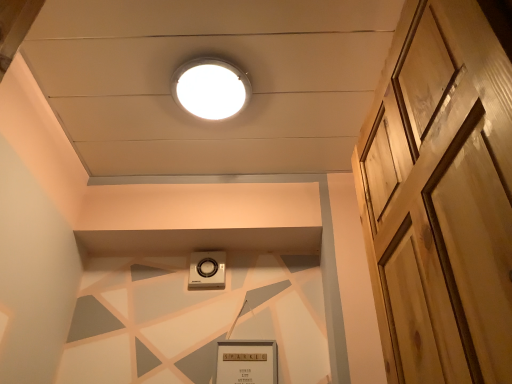
Question: Considering their positions, is white glossy droplight at upper center located in front of or behind white plastic thermostat at center?

Choices:
 (A) front
 (B) behind

Answer: (A)

Question: Is point (206, 105) positioned closer to the camera than point (194, 281)?

Choices:
 (A) farther
 (B) closer

Answer: (B)

Question: Which of these objects is positioned closest to the light brown wooden door at right?

Choices:
 (A) white plastic thermostat at center
 (B) white glossy droplight at upper center

Answer: (B)

Question: Which object is the closest to the white glossy droplight at upper center?

Choices:
 (A) light brown wooden door at right
 (B) white plastic thermostat at center

Answer: (B)